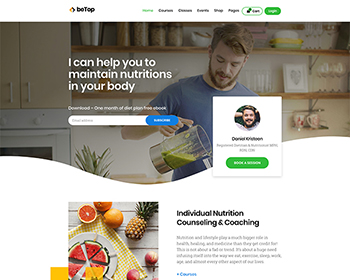
The image size is (350, 280). In order to click on table in this screenshot , I will do `click(149, 242)`.